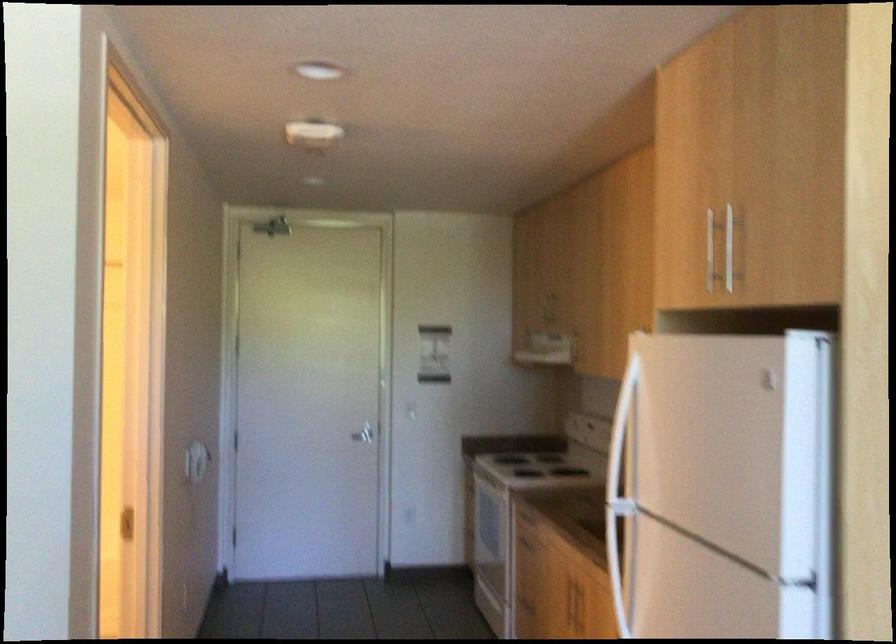
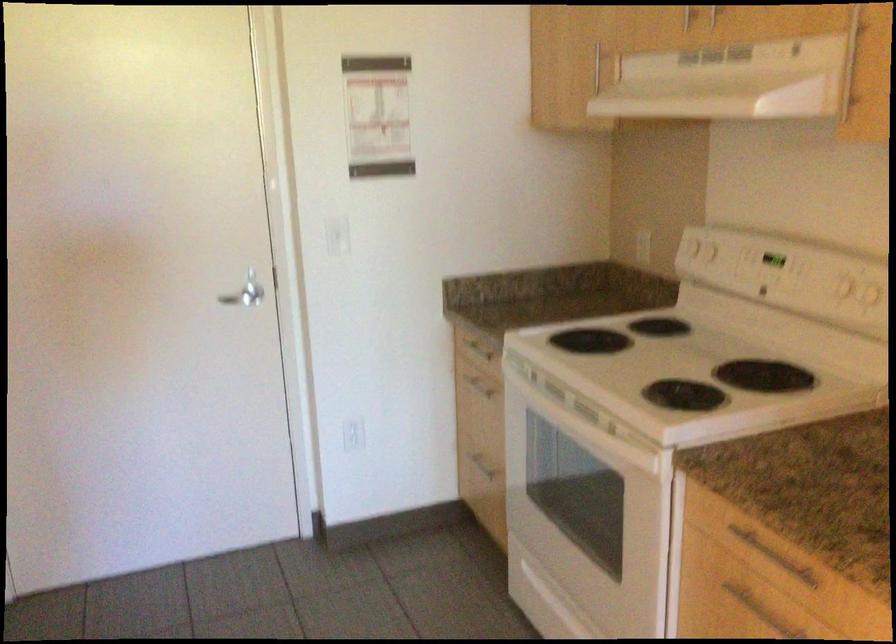
In the second image, find the point that corresponds to (590,325) in the first image.

(868, 77)